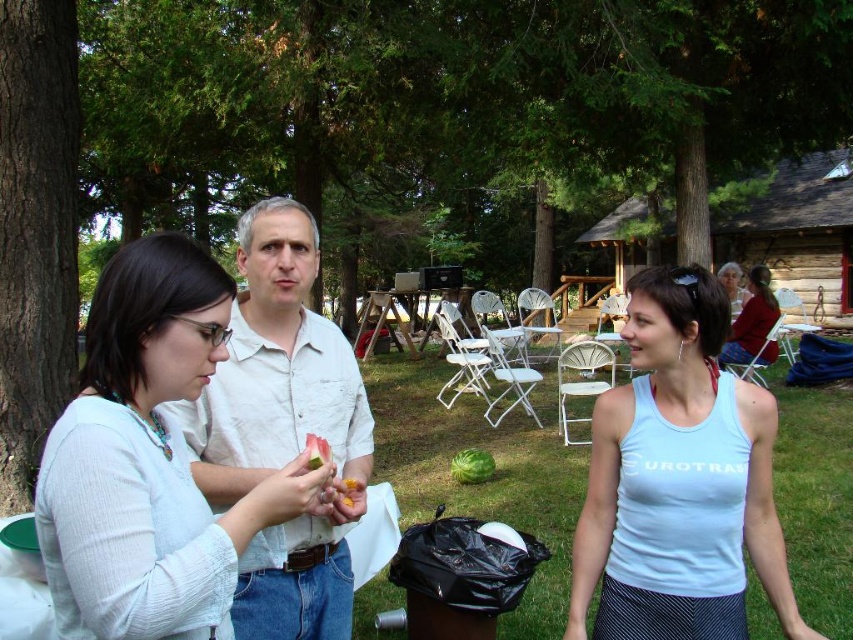
Which is behind, point (126, 449) or point (492, 474)?

Positioned behind is point (492, 474).

Who is more distant from viewer, (x=83, y=589) or (x=450, y=474)?

The point (x=450, y=474) is more distant.

Where is `matte white shirt at center`? matte white shirt at center is located at coordinates (149, 460).

From the picture: Does matte white shirt at center have a larger size compared to white cotton shirt at center?

Actually, matte white shirt at center might be smaller than white cotton shirt at center.

Who is shorter, matte white shirt at center or white cotton shirt at center?

matte white shirt at center is shorter.

Is point (283, 506) behind point (277, 572)?

No, (283, 506) is closer to viewer.

Locate an element on the screen. Image resolution: width=853 pixels, height=640 pixels. matte white shirt at center is located at coordinates (149, 460).

What do you see at coordinates (473, 467) in the screenshot?
I see `green matte watermelon at center` at bounding box center [473, 467].

Is point (460, 467) positioned in front of point (349, 506)?

No, (460, 467) is behind (349, 506).

Locate an element on the screen. green matte watermelon at center is located at coordinates (473, 467).